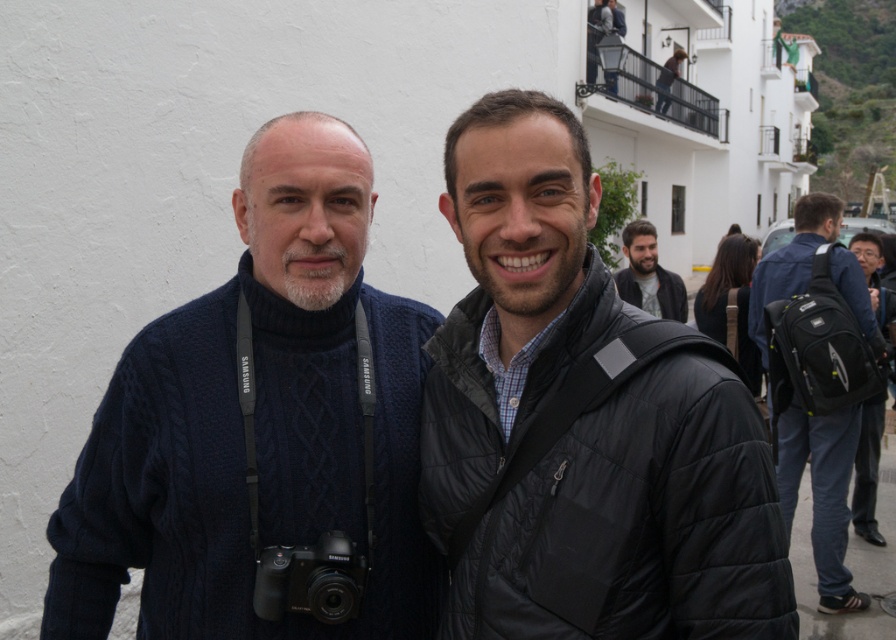
Between black matte backpack at right and bearded man at center, which one is positioned lower?

black matte backpack at right is below.

Is black matte backpack at right further to the viewer compared to bearded man at center?

No, it is not.

Is point (871, 250) positioned before point (679, 320)?

No, it is behind (679, 320).

Where is `black matte backpack at right`? The height and width of the screenshot is (640, 896). black matte backpack at right is located at coordinates (x=868, y=467).

Can you confirm if cable-knit sweater at center is positioned above black synthetic backpack at right?

No, cable-knit sweater at center is not above black synthetic backpack at right.

Is the position of cable-knit sweater at center more distant than that of black synthetic backpack at right?

No, it is in front of black synthetic backpack at right.

Does point (151, 545) come in front of point (831, 502)?

Yes, point (151, 545) is closer to viewer.

The image size is (896, 640). Find the location of `cable-knit sweater at center`. cable-knit sweater at center is located at coordinates (257, 422).

Between black synthetic backpack at right and bearded man at center, which one has less height?

With less height is bearded man at center.

Is black synthetic backpack at right in front of bearded man at center?

Yes, black synthetic backpack at right is closer to the viewer.

What do you see at coordinates (823, 492) in the screenshot?
I see `black synthetic backpack at right` at bounding box center [823, 492].

You are a GUI agent. You are given a task and a screenshot of the screen. Output one action in this format:
    pyautogui.click(x=<x>, y=<y>)
    Task: Click on the black synthetic backpack at right
    The width and height of the screenshot is (896, 640).
    Given the screenshot: What is the action you would take?
    pyautogui.click(x=823, y=492)